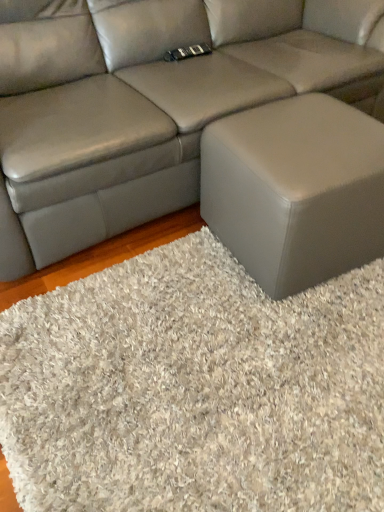
The image size is (384, 512). Find the location of `empty space that is ontop of matte gray ottoman at lower right (from a real-world perspective)`. empty space that is ontop of matte gray ottoman at lower right (from a real-world perspective) is located at coordinates (306, 145).